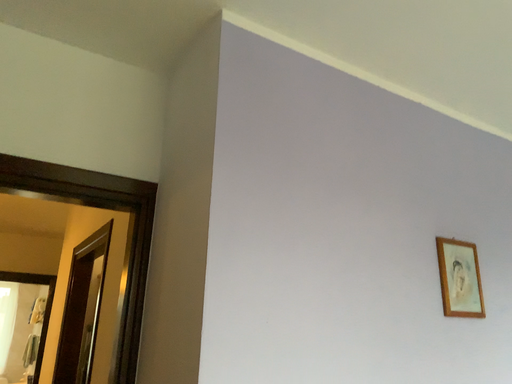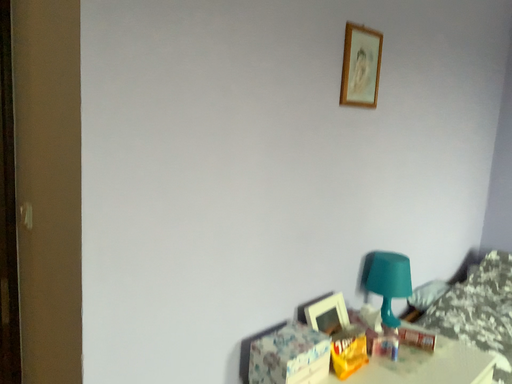
Question: How did the camera likely rotate when shooting the video?

Choices:
 (A) rotated left
 (B) rotated right

Answer: (B)